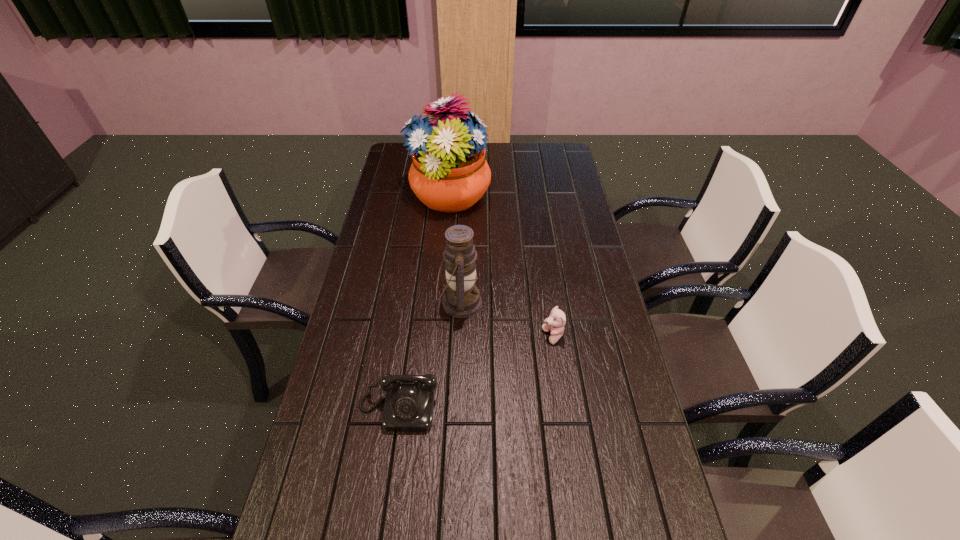
You are a GUI agent. You are given a task and a screenshot of the screen. Output one action in this format:
    pyautogui.click(x=<x>, y=<y>)
    Task: Click on the free region located at the face of the teddy bear
    The width and height of the screenshot is (960, 540).
    Given the screenshot: What is the action you would take?
    pyautogui.click(x=455, y=336)

Image resolution: width=960 pixels, height=540 pixels. In order to click on vacant space situated 0.350m at the face of the teddy bear in this screenshot , I will do `click(424, 336)`.

Locate an element on the screen. The image size is (960, 540). vacant region located 0.220m on the dial of the telephone is located at coordinates (381, 530).

The width and height of the screenshot is (960, 540). I want to click on flower arrangement present at the left edge, so click(449, 173).

Where is `telephone at the left edge`? The height and width of the screenshot is (540, 960). telephone at the left edge is located at coordinates pyautogui.click(x=409, y=402).

In the image, there is a desktop. Identify the location of vacant area at the left edge. (345, 457).

Image resolution: width=960 pixels, height=540 pixels. I want to click on vacant space at the right edge, so click(x=551, y=184).

Identify the location of vacant area that lies between the farthest object and the teddy bear. (501, 267).

This screenshot has width=960, height=540. What are the coordinates of `free space between the rightmost object and the oil lamp` in the screenshot? It's located at (507, 320).

Locate an element on the screen. This screenshot has width=960, height=540. free spot between the rightmost object and the tallest object is located at coordinates (501, 267).